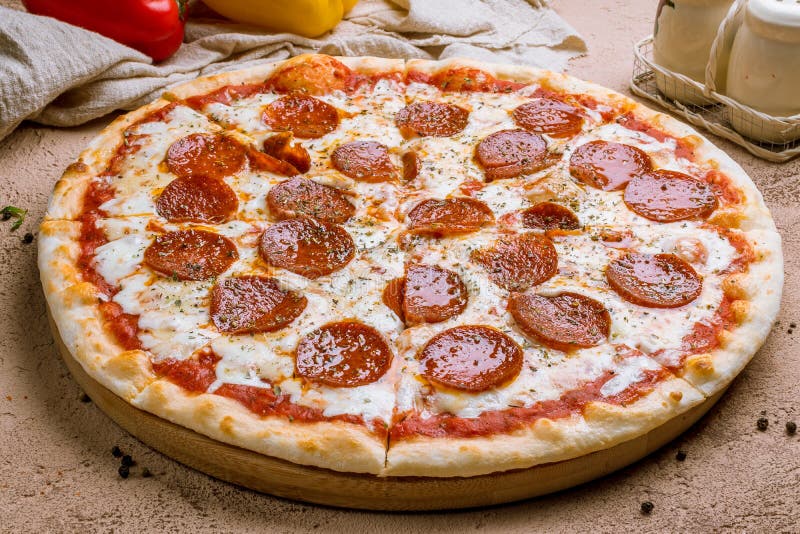
You are a GUI agent. You are given a task and a screenshot of the screen. Output one action in this format:
    pyautogui.click(x=<x>, y=<y>)
    Task: Click on the jars in a basket
    Image resolution: width=800 pixels, height=534 pixels.
    Given the screenshot: What is the action you would take?
    pyautogui.click(x=664, y=28), pyautogui.click(x=761, y=61), pyautogui.click(x=741, y=97), pyautogui.click(x=732, y=29)